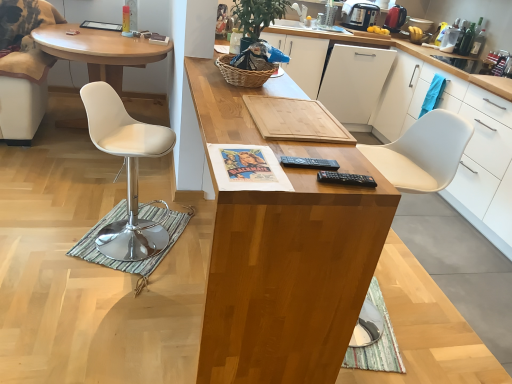
Image resolution: width=512 pixels, height=384 pixels. Find the location of `vacant space to the left of black plastic remote control at right, marked as the first remote control in a bottom-to-top arrangement`. vacant space to the left of black plastic remote control at right, marked as the first remote control in a bottom-to-top arrangement is located at coordinates pyautogui.click(x=292, y=171).